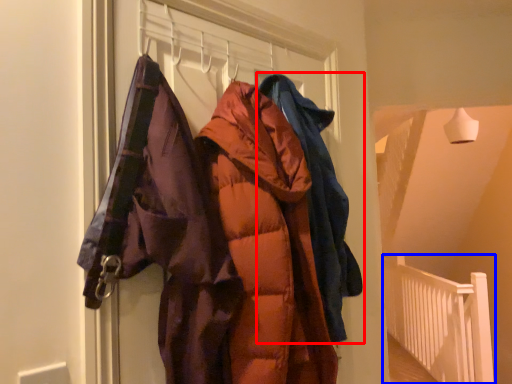
Question: Among these objects, which one is nearest to the camera, jacket (highlighted by a red box) or balustrade (highlighted by a blue box)?

Choices:
 (A) jacket
 (B) balustrade

Answer: (A)